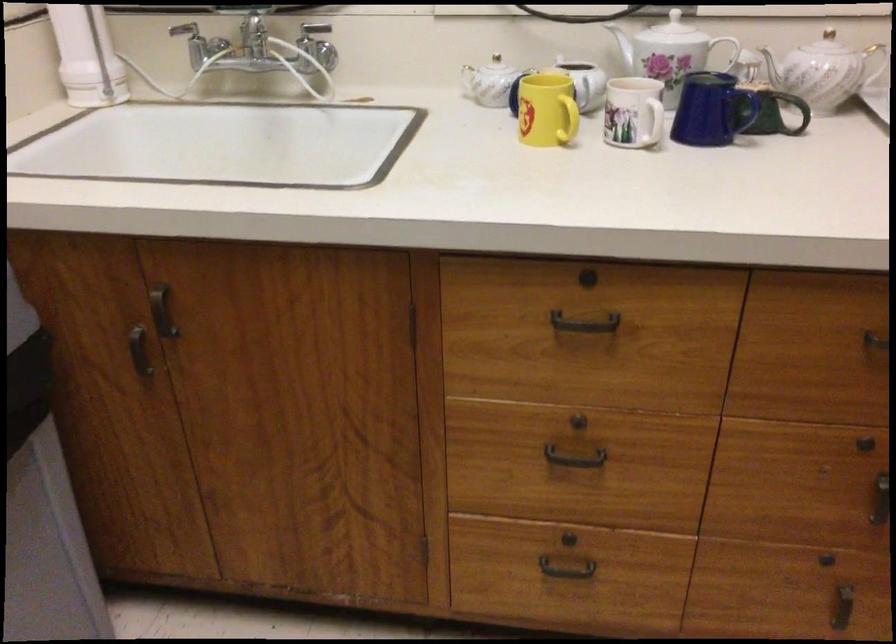
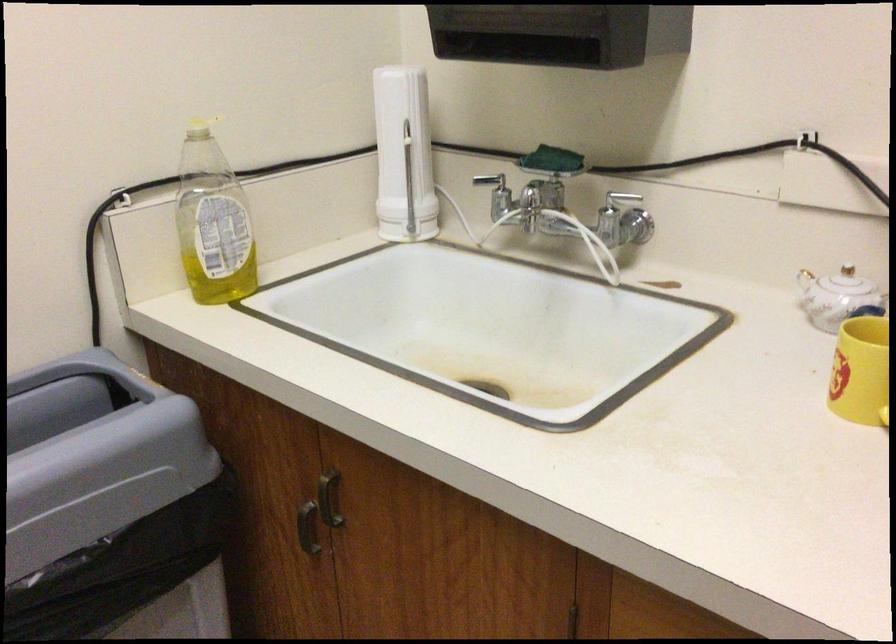
Where in the second image is the point corresponding to pixel 501 71 from the first image?

(848, 287)